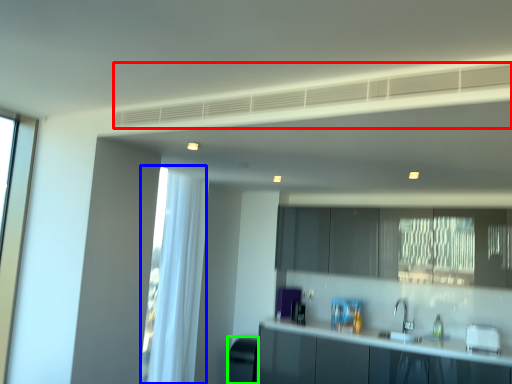
Question: Based on their relative distances, which object is farther from exhaust hood (highlighted by a red box)? Choose from curtain (highlighted by a blue box) and appliance (highlighted by a green box).

Choices:
 (A) curtain
 (B) appliance

Answer: (B)